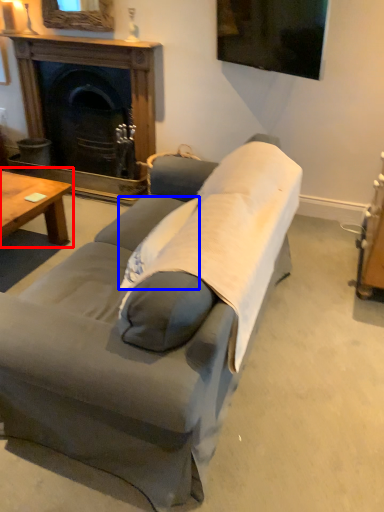
Question: Among these objects, which one is farthest to the camera, coffee table (highlighted by a red box) or pillow (highlighted by a blue box)?

Choices:
 (A) coffee table
 (B) pillow

Answer: (A)